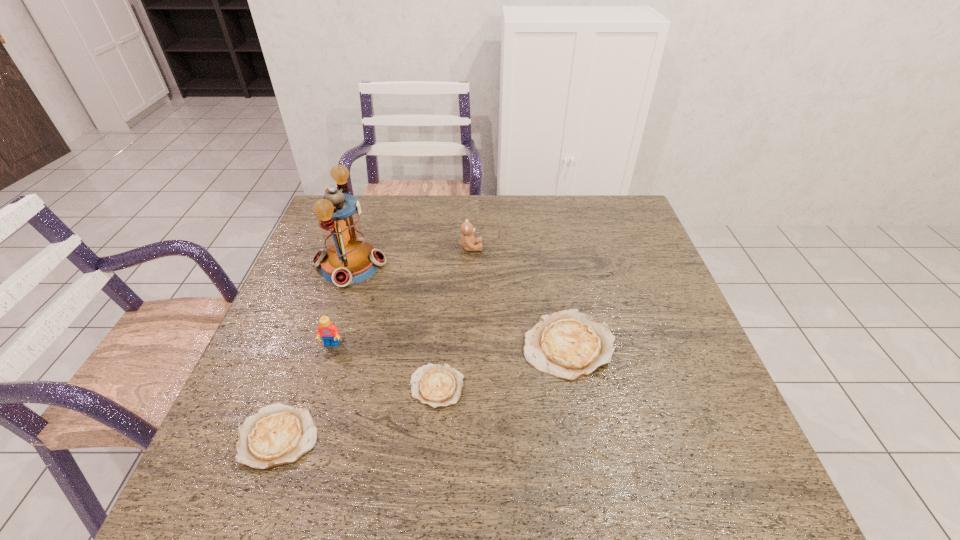
Where is `the second shortest object`? the second shortest object is located at coordinates (278, 434).

Locate an element on the screen. Image resolution: width=960 pixels, height=540 pixels. the second tallest quiche is located at coordinates (278, 434).

Image resolution: width=960 pixels, height=540 pixels. I want to click on the shortest quiche, so click(437, 385).

Where is `the second quiche from right to left`? This screenshot has width=960, height=540. the second quiche from right to left is located at coordinates (437, 385).

This screenshot has width=960, height=540. Find the location of `the third shortest object`. the third shortest object is located at coordinates (568, 344).

Identify the location of the tallest quiche. (568, 344).

This screenshot has height=540, width=960. I want to click on the tallest object, so click(347, 259).

I want to click on teddy bear, so click(x=467, y=241).

Image resolution: width=960 pixels, height=540 pixels. In order to click on Lego in this screenshot , I will do `click(327, 330)`.

Where is `free location located 0.060m on the right of the leftmost quiche`? The width and height of the screenshot is (960, 540). free location located 0.060m on the right of the leftmost quiche is located at coordinates (348, 437).